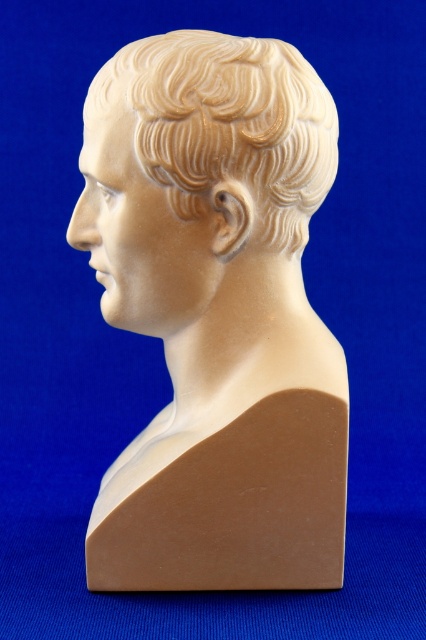
Which is behind, point (337, 461) or point (331, 100)?

Point (331, 100)

Can you confirm if matte white bust at center is smaller than sandy beige wax hair at center?

No, matte white bust at center is not smaller than sandy beige wax hair at center.

What do you see at coordinates (216, 314) in the screenshot? The width and height of the screenshot is (426, 640). I see `matte white bust at center` at bounding box center [216, 314].

At what (x,y) coordinates should I click in order to perform the action: click on matte white bust at center. Please return your answer as a coordinate pair (x, y). Image resolution: width=426 pixels, height=640 pixels. Looking at the image, I should click on (216, 314).